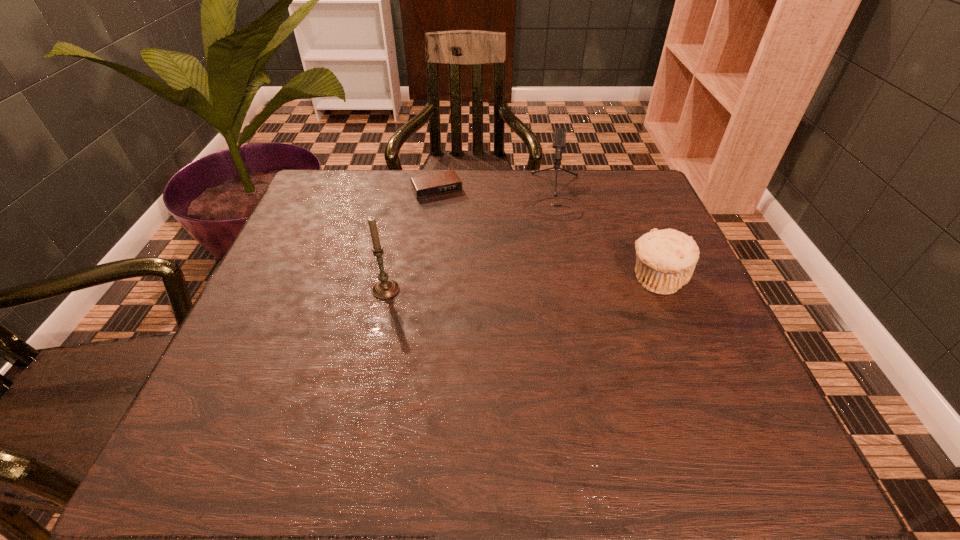
This screenshot has height=540, width=960. I want to click on free region located on the stand of the second object from right to left, so click(559, 328).

This screenshot has width=960, height=540. What are the coordinates of `free space located on the stand of the second object from right to left` in the screenshot? It's located at (556, 240).

The image size is (960, 540). In order to click on vacant space situated 0.080m on the stand of the second object from right to left in this screenshot , I will do `click(556, 240)`.

You are a GUI agent. You are given a task and a screenshot of the screen. Output one action in this format:
    pyautogui.click(x=<x>, y=<y>)
    Task: Click on the alarm clock at the far edge
    This screenshot has height=540, width=960.
    Given the screenshot: What is the action you would take?
    pyautogui.click(x=444, y=183)

Locate an element on the screen. This screenshot has height=540, width=960. microphone present at the far edge is located at coordinates (559, 140).

In order to click on object present at the right edge in this screenshot , I will do `click(666, 259)`.

You are a GUI agent. You are given a task and a screenshot of the screen. Output one action in this format:
    pyautogui.click(x=<x>, y=<y>)
    Task: Click on the free region at the far edge
    
    Given the screenshot: What is the action you would take?
    pyautogui.click(x=394, y=186)

The width and height of the screenshot is (960, 540). I want to click on free space at the near edge of the desktop, so click(619, 398).

Image resolution: width=960 pixels, height=540 pixels. Identify the location of vacant space at the far left corner. (326, 189).

I want to click on free region at the near left corner of the desktop, so click(x=272, y=395).